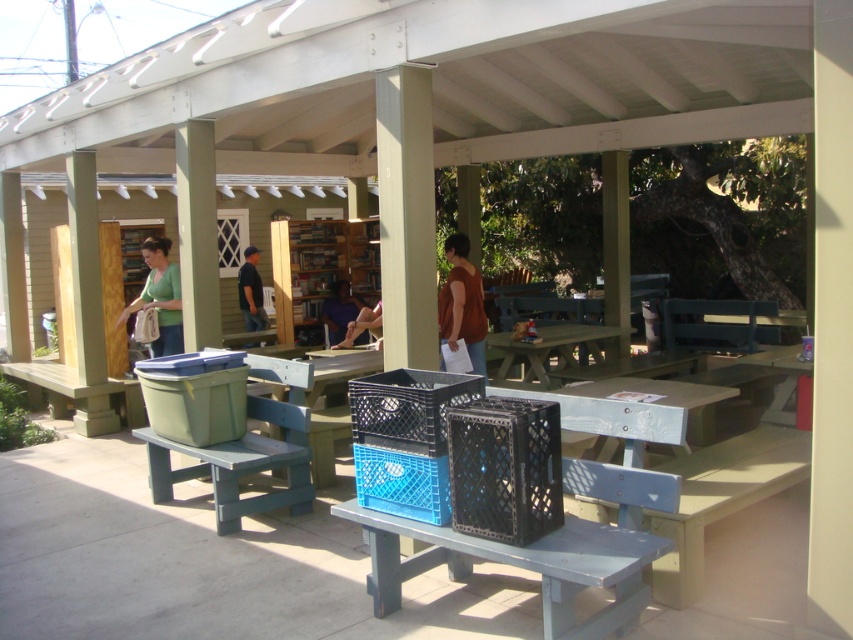
In the scene shown: You are standing at the entrance of the pergola and want to place a new bookshelf near the green plastic picnic table at center. Based on the coordinates provided, can you determine if the space is suitable for a standard bookshelf that requires 1.2 meters of clearance in all directions?

The green plastic picnic table at center is located at coordinates point (x=556, y=348). However, without knowing the scale or dimensions of the pergola and the exact size of the bookshelf, it is impossible to determine if the space is suitable. Please provide more information about the area dimensions or the bookshelf size for an accurate assessment.

You are a maintenance worker needing to move a heavy 2.5 meter long ladder from the storage area to the tool shed. The path between the blue plastic table at center and the green painted wood bench at left is the only route available. Can the ladder be moved through this path without tilting it sideways?

The distance between the blue plastic table at center and the green painted wood bench at left is 3.00 meters. Since the ladder is 2.5 meters long, it can be moved through the path as the available space is wider than the ladder.

You are standing at the point marked by the coordinate point (312,372). Looking around, you see the blue plastic table at center. What is the nearest object to you?

The nearest object to you is the blue plastic table at center, as you are standing exactly at its marked coordinate point.